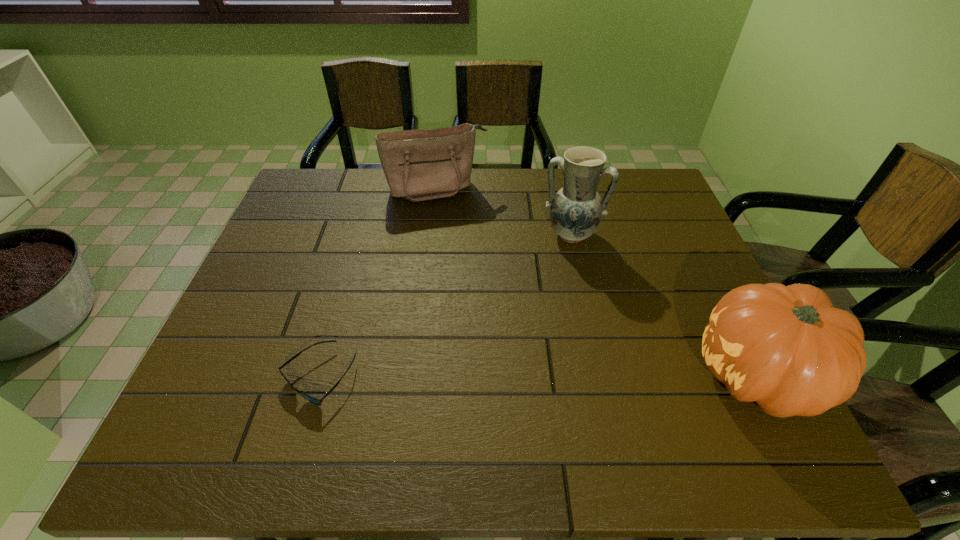
The image size is (960, 540). In the image, there is a desktop. What are the coordinates of `vacant space at the left edge` in the screenshot? It's located at (274, 346).

Locate an element on the screen. Image resolution: width=960 pixels, height=540 pixels. free space at the right edge of the desktop is located at coordinates (625, 217).

Find the location of a particular element. vacant space at the near left corner of the desktop is located at coordinates (250, 394).

The width and height of the screenshot is (960, 540). In order to click on vacant space at the far right corner of the desktop in this screenshot , I will do (651, 170).

At what (x,y) coordinates should I click in order to perform the action: click on vacant space in between the rightmost object and the sunglasses. Please return your answer as a coordinate pair (x, y). The height and width of the screenshot is (540, 960). Looking at the image, I should click on (539, 376).

The width and height of the screenshot is (960, 540). I want to click on unoccupied area between the pumpkin and the farthest object, so click(x=597, y=282).

Identify the location of empty space between the second farthest object and the sunglasses. (445, 306).

Find the location of a particular element. free space between the pumpkin and the farthest object is located at coordinates (597, 282).

The height and width of the screenshot is (540, 960). I want to click on empty space between the sunglasses and the pumpkin, so click(x=539, y=376).

The image size is (960, 540). What are the coordinates of `free space between the shoulder bag and the pottery` in the screenshot? It's located at (504, 211).